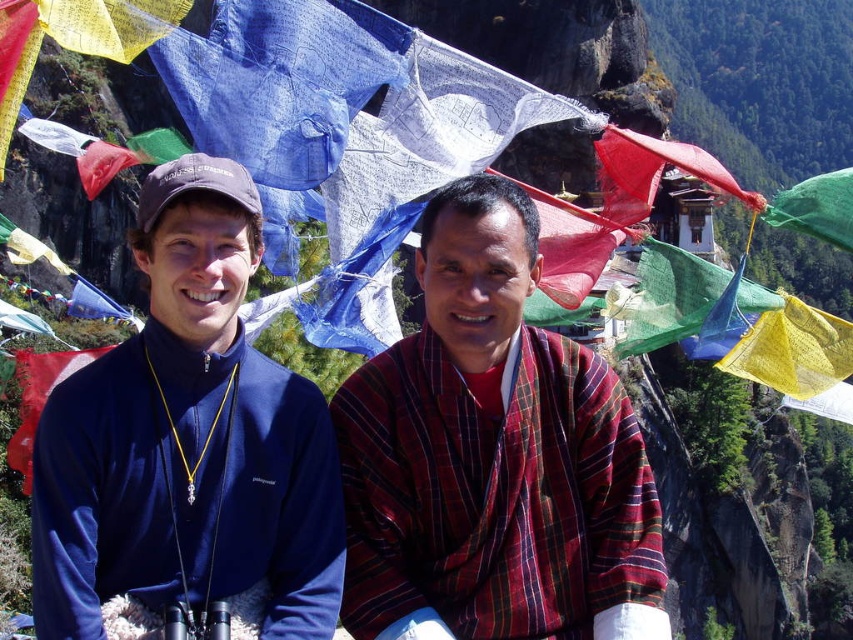
You are a photographer standing at the center of the scene. You want to take a photo of both the plaid fabric shirt at center and the navy blue fleece at left. Given that your camera has a maximum focus range of 5 meters, will both subjects be in focus?

The plaid fabric shirt at center is 6.33 meters away from the navy blue fleece at left. Since the maximum focus range is 5 meters, the distance between them exceeds this limit, so both subjects cannot be in focus simultaneously.

You are a photographer trying to capture a group photo of the plaid fabric shirt at center and the navy blue fleece at left. To ensure both subjects are fully visible in the frame, which subject should you position closer to the camera to avoid cropping?

The plaid fabric shirt at center has a lesser width compared to the navy blue fleece at left, so positioning the plaid fabric shirt at center closer to the camera would allow it to take up more space in the frame, ensuring both subjects are fully visible without cropping.